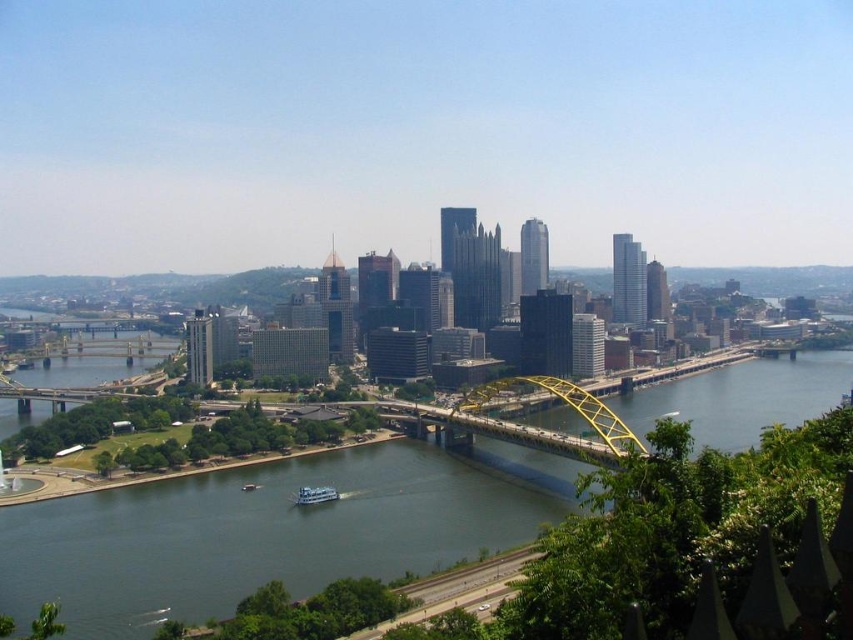
Based on the photo, you are a tour guide explaining the city layout to visitors. You point out the yellow metallic bridge at center and the white glossy boat at center. How far apart are these two landmarks?

The yellow metallic bridge at center and the white glossy boat at center are 338.09 feet apart from each other.

You are standing at the point closer to you between point [28,608] and point [300,499] in the cityscape. Which point are you standing at?

You are standing at point [28,608] because it is closer to the viewer than point [300,499].